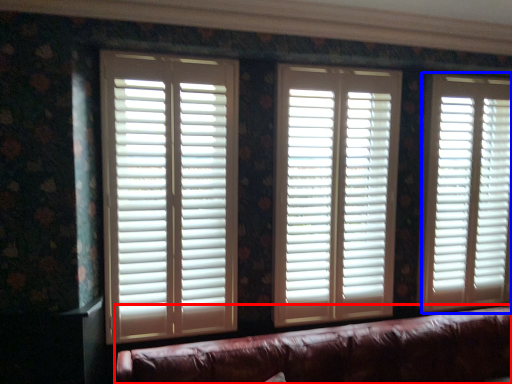
Question: Which of the following is the closest to the observer, studio couch (highlighted by a red box) or window blind (highlighted by a blue box)?

Choices:
 (A) studio couch
 (B) window blind

Answer: (A)